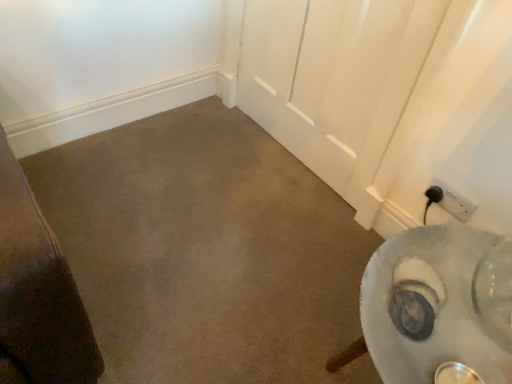
Question: Considering their positions, is black plastic power plug at lower right located in front of or behind brown matte concrete at center?

Choices:
 (A) behind
 (B) front

Answer: (A)

Question: Is black plastic power plug at lower right inside the boundaries of brown matte concrete at center, or outside?

Choices:
 (A) inside
 (B) outside

Answer: (B)

Question: Considering the positions of black plastic power plug at lower right and brown matte concrete at center in the image, is black plastic power plug at lower right wider or thinner than brown matte concrete at center?

Choices:
 (A) thin
 (B) wide

Answer: (A)

Question: Is brown matte concrete at center to the left or to the right of black plastic power plug at lower right in the image?

Choices:
 (A) right
 (B) left

Answer: (B)

Question: Looking at the image, does brown matte concrete at center seem bigger or smaller compared to black plastic power plug at lower right?

Choices:
 (A) big
 (B) small

Answer: (A)

Question: Considering their positions, is brown matte concrete at center located in front of or behind black plastic power plug at lower right?

Choices:
 (A) front
 (B) behind

Answer: (A)

Question: Is brown matte concrete at center spatially inside black plastic power plug at lower right, or outside of it?

Choices:
 (A) inside
 (B) outside

Answer: (B)